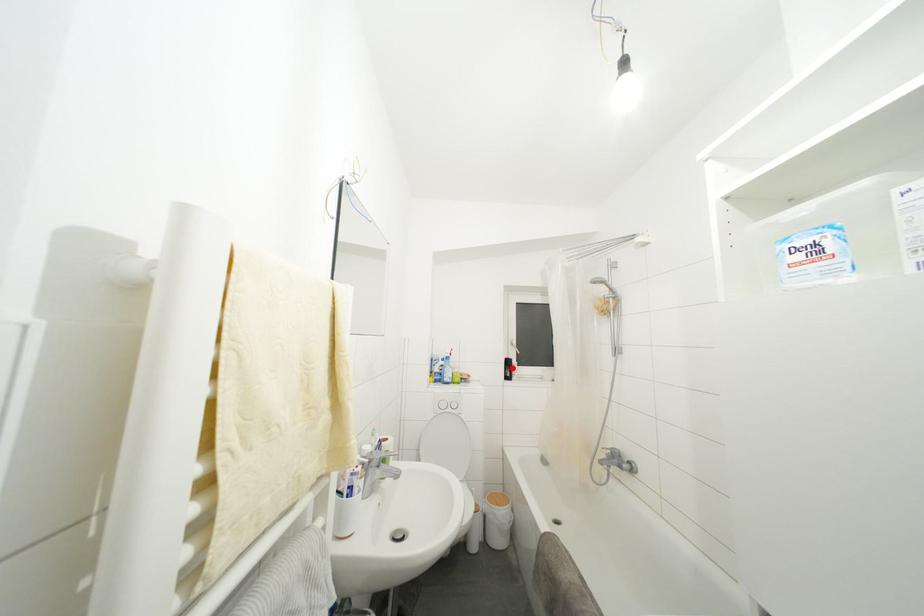
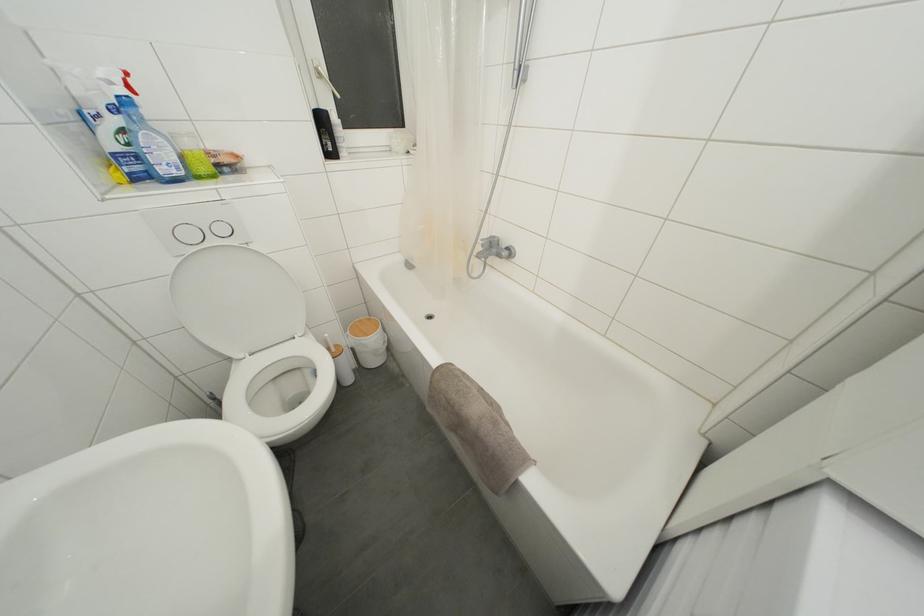
Find the pixel in the second image that matches the highlighted location in the first image.

(325, 126)